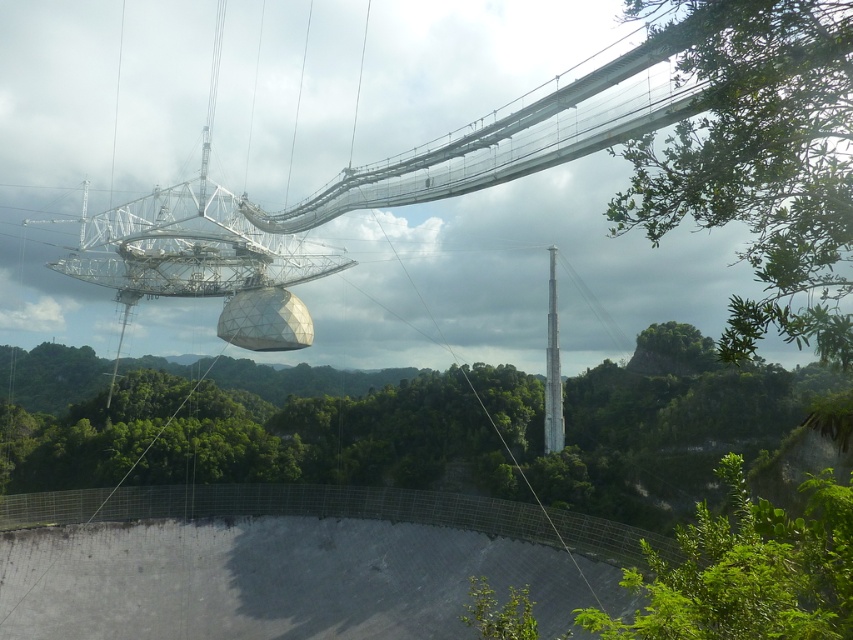
Can you confirm if green leafy tree at lower right is positioned to the left of smooth gray pole at center?

Indeed, green leafy tree at lower right is positioned on the left side of smooth gray pole at center.

Does green leafy tree at lower right appear on the right side of smooth gray pole at center?

Incorrect, green leafy tree at lower right is not on the right side of smooth gray pole at center.

What are the coordinates of `green leafy tree at lower right` in the screenshot? It's located at (747, 572).

Which of these two, green leafy tree at center or smooth gray pole at center, stands shorter?

Standing shorter between the two is green leafy tree at center.

Between green leafy tree at center and smooth gray pole at center, which one has more height?

smooth gray pole at center

Is point (643, 380) closer to viewer compared to point (549, 385)?

No, (643, 380) is behind (549, 385).

Image resolution: width=853 pixels, height=640 pixels. What are the coordinates of `green leafy tree at center` in the screenshot? It's located at (508, 429).

Who is more distant from viewer, (846, 32) or (550, 323)?

Positioned behind is point (550, 323).

Does point (668, 195) come in front of point (549, 296)?

Yes, point (668, 195) is closer to viewer.

The width and height of the screenshot is (853, 640). Find the location of `green leafy tree at upper right`. green leafy tree at upper right is located at coordinates (762, 161).